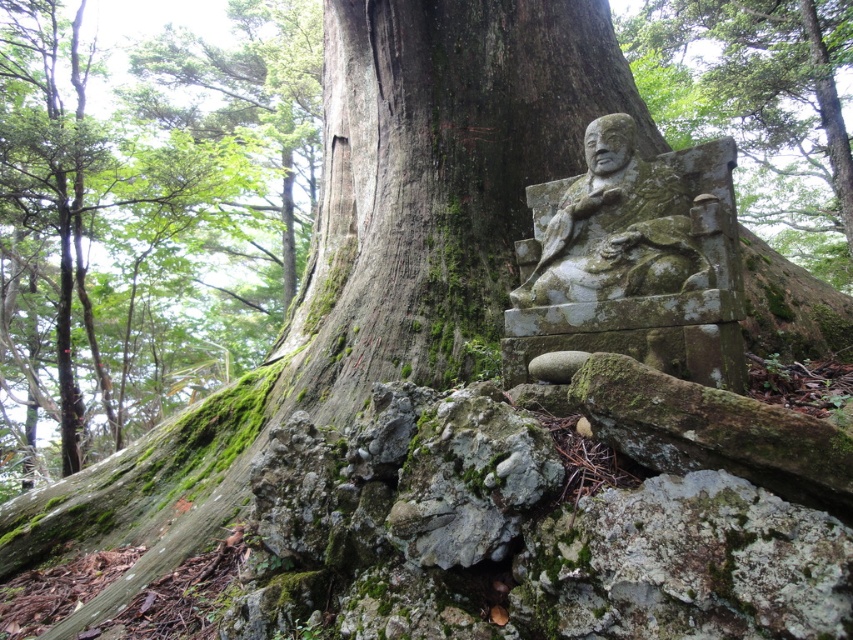
You are a hiker who wants to place a small marker exactly at the center of the forest scene. According to the coordinates provided, where should you place the marker relative to the green mossy stone statue at center?

The green mossy stone statue at center is located at coordinates point (x=633, y=260). Therefore, the marker should be placed at the center of the forest scene, which is at point (x=426, y=320). The statue is slightly to the left and above the true center.

You are a forest ranger measuring the width of the green mossy stone statue at center and the green mossy stone statue at lower right. Which one has a smaller width?

The green mossy stone statue at center has a smaller width than the green mossy stone statue at lower right.

You are a hiker walking towards the green mossy bark at lower left and the green mossy stone statue at center. Which object will you encounter first?

The green mossy bark at lower left is closer to you, so you will encounter it first before reaching the green mossy stone statue at center.